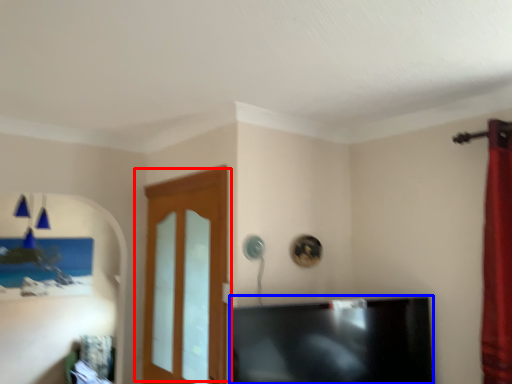
Question: Among these objects, which one is nearest to the camera, door (highlighted by a red box) or television (highlighted by a blue box)?

Choices:
 (A) door
 (B) television

Answer: (B)